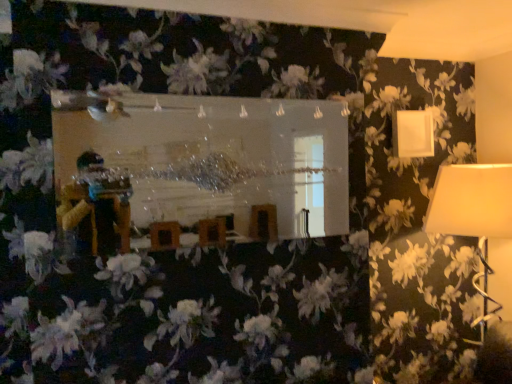
Describe the element at coordinates (474, 217) in the screenshot. I see `white fabric lampshade at right, the second lamp in the top-to-bottom sequence` at that location.

How much space does white matte lampshade at upper right, which is counted as the 1th lamp, starting from the top, occupy vertically?

The height of white matte lampshade at upper right, which is counted as the 1th lamp, starting from the top, is 29.94 centimeters.

This screenshot has width=512, height=384. Describe the element at coordinates (205, 162) in the screenshot. I see `clear glass mirror at center` at that location.

I want to click on white fabric lampshade at right, the second lamp in the top-to-bottom sequence, so click(x=474, y=217).

Which of these two, white fabric lampshade at right, positioned as the first lamp in bottom-to-top order, or white matte lampshade at upper right, which is counted as the 1th lamp, starting from the top, stands shorter?

Standing shorter between the two is white matte lampshade at upper right, which is counted as the 1th lamp, starting from the top.

Is there a large distance between white fabric lampshade at right, positioned as the first lamp in bottom-to-top order, and white matte lampshade at upper right, which is counted as the 1th lamp, starting from the top?

Result: No, white fabric lampshade at right, positioned as the first lamp in bottom-to-top order, is in close proximity to white matte lampshade at upper right, which is counted as the 1th lamp, starting from the top.

Which of these two, white fabric lampshade at right, the second lamp in the top-to-bottom sequence, or white matte lampshade at upper right, acting as the 2th lamp starting from the bottom, is smaller?

With smaller size is white matte lampshade at upper right, acting as the 2th lamp starting from the bottom.

Looking at their sizes, would you say white matte lampshade at upper right, which is counted as the 1th lamp, starting from the top, is wider or thinner than clear glass mirror at center?

Considering their sizes, white matte lampshade at upper right, which is counted as the 1th lamp, starting from the top, looks slimmer than clear glass mirror at center.

Between white matte lampshade at upper right, which is counted as the 1th lamp, starting from the top, and clear glass mirror at center, which one appears on the left side from the viewer's perspective?

Positioned to the left is clear glass mirror at center.

Is clear glass mirror at center at the back of white matte lampshade at upper right, acting as the 2th lamp starting from the bottom?

No, clear glass mirror at center is not at the back of white matte lampshade at upper right, acting as the 2th lamp starting from the bottom.

Is white matte lampshade at upper right, which is counted as the 1th lamp, starting from the top, spatially inside clear glass mirror at center, or outside of it?

white matte lampshade at upper right, which is counted as the 1th lamp, starting from the top, is located beyond the bounds of clear glass mirror at center.

The width and height of the screenshot is (512, 384). I want to click on lamp located above the clear glass mirror at center (from a real-world perspective), so click(414, 133).

From a real-world perspective, does clear glass mirror at center sit lower than white matte lampshade at upper right, which is counted as the 1th lamp, starting from the top?

Yes, from a real-world perspective, clear glass mirror at center is below white matte lampshade at upper right, which is counted as the 1th lamp, starting from the top.

Does point (104, 128) appear closer or farther from the camera than point (431, 145)?

Clearly, point (104, 128) is closer to the camera than point (431, 145).

Can you confirm if clear glass mirror at center is positioned to the right of white matte lampshade at upper right, acting as the 2th lamp starting from the bottom?

No.

From the image's perspective, is white matte lampshade at upper right, acting as the 2th lamp starting from the bottom, located beneath white fabric lampshade at right, the second lamp in the top-to-bottom sequence?

No.

Is white matte lampshade at upper right, which is counted as the 1th lamp, starting from the top, taller than white fabric lampshade at right, the second lamp in the top-to-bottom sequence?

In fact, white matte lampshade at upper right, which is counted as the 1th lamp, starting from the top, may be shorter than white fabric lampshade at right, the second lamp in the top-to-bottom sequence.

Is white matte lampshade at upper right, acting as the 2th lamp starting from the bottom, not inside white fabric lampshade at right, the second lamp in the top-to-bottom sequence?

Answer: That's correct, white matte lampshade at upper right, acting as the 2th lamp starting from the bottom, is outside of white fabric lampshade at right, the second lamp in the top-to-bottom sequence.

Does point (424, 151) lie in front of point (476, 189)?

No.

Measure the distance from clear glass mirror at center to white fabric lampshade at right, the second lamp in the top-to-bottom sequence.

A distance of 2.00 meters exists between clear glass mirror at center and white fabric lampshade at right, the second lamp in the top-to-bottom sequence.

Considering the sizes of objects clear glass mirror at center and white fabric lampshade at right, positioned as the first lamp in bottom-to-top order, in the image provided, who is bigger, clear glass mirror at center or white fabric lampshade at right, positioned as the first lamp in bottom-to-top order,?

With larger size is white fabric lampshade at right, positioned as the first lamp in bottom-to-top order.

From a real-world perspective, is clear glass mirror at center on white fabric lampshade at right, positioned as the first lamp in bottom-to-top order?

Correct, in the physical world, clear glass mirror at center is higher than white fabric lampshade at right, positioned as the first lamp in bottom-to-top order.

Find the location of a particular element. Image resolution: width=512 pixels, height=384 pixels. mirror that appears above the white fabric lampshade at right, positioned as the first lamp in bottom-to-top order (from a real-world perspective) is located at coordinates (205, 162).

Is white fabric lampshade at right, positioned as the first lamp in bottom-to-top order, facing away from clear glass mirror at center?

That's not correct — white fabric lampshade at right, positioned as the first lamp in bottom-to-top order, is not looking away from clear glass mirror at center.

Which is more to the right, white fabric lampshade at right, positioned as the first lamp in bottom-to-top order, or clear glass mirror at center?

white fabric lampshade at right, positioned as the first lamp in bottom-to-top order, is more to the right.

Who is shorter, white fabric lampshade at right, the second lamp in the top-to-bottom sequence, or clear glass mirror at center?

With less height is clear glass mirror at center.

From the image's perspective, is white fabric lampshade at right, positioned as the first lamp in bottom-to-top order, on clear glass mirror at center?

No, from the image's perspective, white fabric lampshade at right, positioned as the first lamp in bottom-to-top order, is not on top of clear glass mirror at center.

Locate an element on the screen. This screenshot has width=512, height=384. lamp behind the white fabric lampshade at right, positioned as the first lamp in bottom-to-top order is located at coordinates (414, 133).

What are the coordinates of `lamp above the clear glass mirror at center (from the image's perspective)` in the screenshot? It's located at (414, 133).

Looking at the image, which one is located further to white fabric lampshade at right, the second lamp in the top-to-bottom sequence, white matte lampshade at upper right, acting as the 2th lamp starting from the bottom, or clear glass mirror at center?

clear glass mirror at center.

Which object lies nearer to the anchor point white matte lampshade at upper right, which is counted as the 1th lamp, starting from the top, clear glass mirror at center or white fabric lampshade at right, positioned as the first lamp in bottom-to-top order?

Among the two, white fabric lampshade at right, positioned as the first lamp in bottom-to-top order, is located nearer to white matte lampshade at upper right, which is counted as the 1th lamp, starting from the top.

When comparing their distances from white matte lampshade at upper right, which is counted as the 1th lamp, starting from the top, does white fabric lampshade at right, positioned as the first lamp in bottom-to-top order, or clear glass mirror at center seem closer?

white fabric lampshade at right, positioned as the first lamp in bottom-to-top order, lies closer to white matte lampshade at upper right, which is counted as the 1th lamp, starting from the top, than the other object.

Looking at this image, estimate the real-world distances between objects in this image. Which object is further from white fabric lampshade at right, the second lamp in the top-to-bottom sequence, clear glass mirror at center or white matte lampshade at upper right, acting as the 2th lamp starting from the bottom?

clear glass mirror at center lies further to white fabric lampshade at right, the second lamp in the top-to-bottom sequence, than the other object.

Which object lies further to the anchor point clear glass mirror at center, white matte lampshade at upper right, which is counted as the 1th lamp, starting from the top, or white fabric lampshade at right, the second lamp in the top-to-bottom sequence?

white fabric lampshade at right, the second lamp in the top-to-bottom sequence.

Estimate the real-world distances between objects in this image. Which object is closer to clear glass mirror at center, white fabric lampshade at right, the second lamp in the top-to-bottom sequence, or white matte lampshade at upper right, acting as the 2th lamp starting from the bottom?

Based on the image, white matte lampshade at upper right, acting as the 2th lamp starting from the bottom, appears to be nearer to clear glass mirror at center.

Identify the location of lamp situated between clear glass mirror at center and white fabric lampshade at right, the second lamp in the top-to-bottom sequence, from left to right. (414, 133).